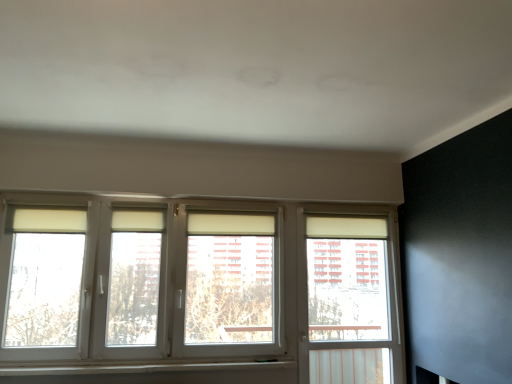
Question: Is white plastic window at right closer to the viewer compared to white plastic window sill at lower center?

Choices:
 (A) yes
 (B) no

Answer: (B)

Question: From a real-world perspective, is white plastic window at right under white plastic window sill at lower center?

Choices:
 (A) yes
 (B) no

Answer: (B)

Question: Can you confirm if white plastic window at right is bigger than white plastic window sill at lower center?

Choices:
 (A) yes
 (B) no

Answer: (A)

Question: From a real-world perspective, is white plastic window at right on top of white plastic window sill at lower center?

Choices:
 (A) no
 (B) yes

Answer: (B)

Question: Are white plastic window at right and white plastic window sill at lower center making contact?

Choices:
 (A) no
 (B) yes

Answer: (A)

Question: Does white plastic window at right have a lesser height compared to white plastic window sill at lower center?

Choices:
 (A) yes
 (B) no

Answer: (B)

Question: Is white plastic window at right thinner than white plastic window at center?

Choices:
 (A) no
 (B) yes

Answer: (B)

Question: Is white plastic window at right looking in the opposite direction of white plastic window at center?

Choices:
 (A) no
 (B) yes

Answer: (A)

Question: From a real-world perspective, is white plastic window at right below white plastic window at center?

Choices:
 (A) yes
 (B) no

Answer: (A)

Question: Is white plastic window at right to the left of white plastic window at center from the viewer's perspective?

Choices:
 (A) no
 (B) yes

Answer: (A)

Question: Is white plastic window at right outside of white plastic window at center?

Choices:
 (A) yes
 (B) no

Answer: (A)

Question: Does white plastic window at right lie in front of white plastic window at center?

Choices:
 (A) no
 (B) yes

Answer: (A)

Question: Does white plastic window at center have a larger size compared to white plastic window sill at lower center?

Choices:
 (A) yes
 (B) no

Answer: (A)